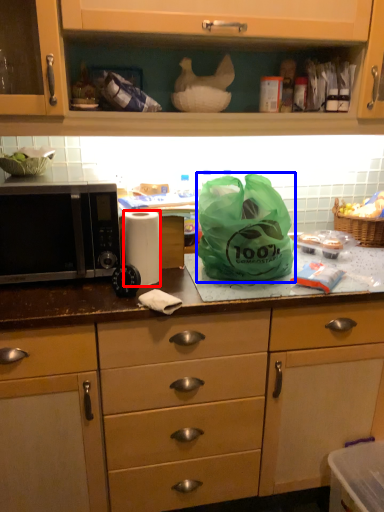
Question: Which object appears farthest to the camera in this image, paper towel (highlighted by a red box) or plastic bag (highlighted by a blue box)?

Choices:
 (A) paper towel
 (B) plastic bag

Answer: (A)